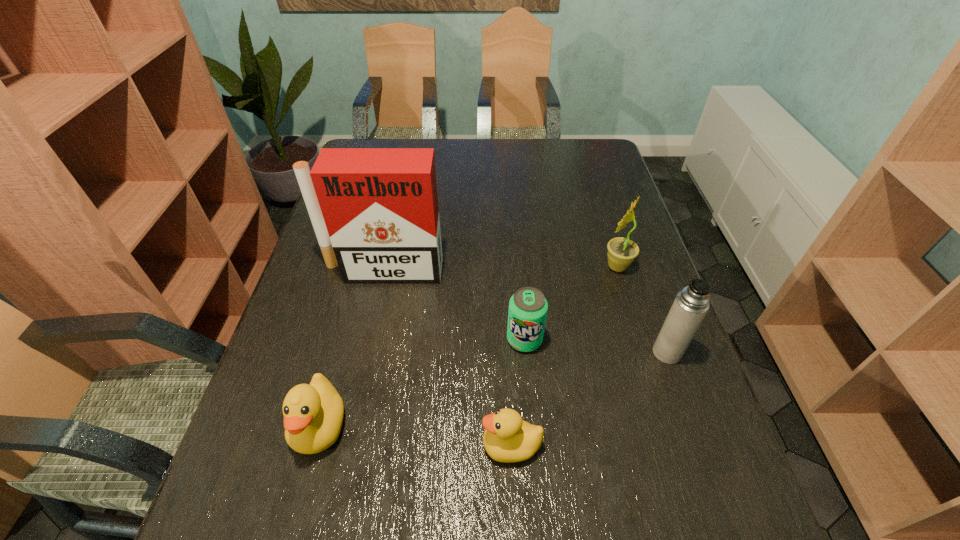
This screenshot has width=960, height=540. Identify the location of object that is at the near left corner. (313, 413).

Find the location of `vacant area at the far edge of the desktop`. vacant area at the far edge of the desktop is located at coordinates (534, 144).

In the image, there is a desktop. What are the coordinates of `vacant space at the near edge` in the screenshot? It's located at (x=468, y=484).

At what (x,y) coordinates should I click in order to perform the action: click on vacant space at the left edge of the desktop. Please return your answer as a coordinate pair (x, y). Image resolution: width=960 pixels, height=540 pixels. Looking at the image, I should click on (307, 354).

At what (x,y) coordinates should I click in order to perform the action: click on vacant space at the right edge of the desktop. Please return your answer as a coordinate pair (x, y). This screenshot has width=960, height=540. Looking at the image, I should click on (632, 308).

Where is `blank region between the sunflower and the thermos bottle`? This screenshot has width=960, height=540. blank region between the sunflower and the thermos bottle is located at coordinates (642, 309).

At what (x,y) coordinates should I click in order to perform the action: click on vacant area between the cigarette case and the sunflower. Please return your answer as a coordinate pair (x, y). The image size is (960, 540). Looking at the image, I should click on (500, 268).

Image resolution: width=960 pixels, height=540 pixels. I want to click on free area in between the left duck and the cigarette case, so click(351, 348).

You are a GUI agent. You are given a task and a screenshot of the screen. Output one action in this format:
    pyautogui.click(x=<x>, y=<y>)
    Task: Click on the free space between the left duck and the pop soda
    This screenshot has width=960, height=540.
    Given the screenshot: What is the action you would take?
    pyautogui.click(x=422, y=382)

This screenshot has height=540, width=960. Identify the location of free space that is in between the shorter duck and the pop soda. (518, 393).